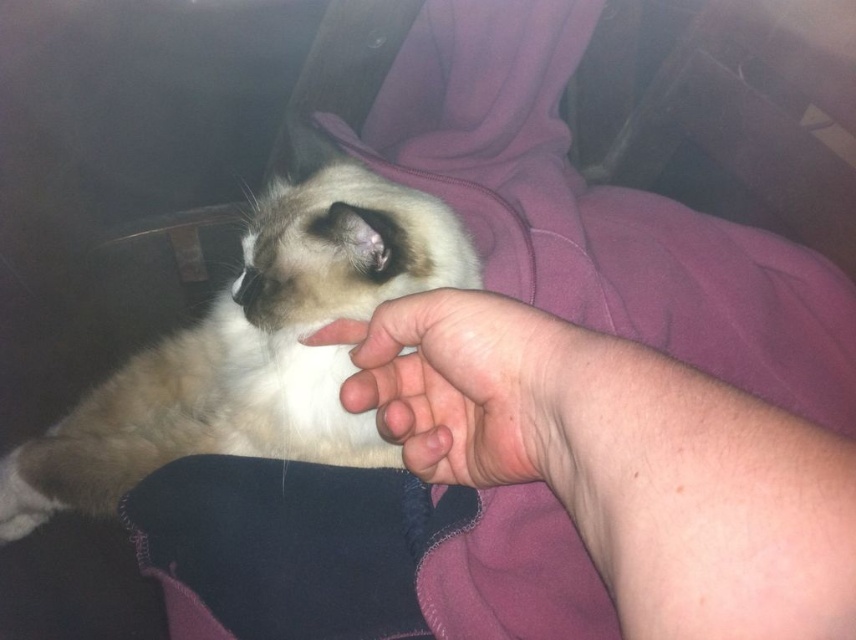
Question: Where is skinny flesh at center located in relation to pink flesh-toned hand at center in the image?

Choices:
 (A) below
 (B) above

Answer: (A)

Question: Considering the real-world distances, which object is farthest from the soft cream fur cat at center?

Choices:
 (A) pink flesh-toned hand at center
 (B) skinny flesh at center

Answer: (B)

Question: Estimate the real-world distances between objects in this image. Which object is farther from the skinny flesh at center?

Choices:
 (A) pink flesh-toned hand at center
 (B) soft cream fur cat at center

Answer: (B)

Question: Is soft cream fur cat at center bigger than pink flesh-toned hand at center?

Choices:
 (A) no
 (B) yes

Answer: (B)

Question: Can you confirm if soft cream fur cat at center is wider than pink flesh-toned hand at center?

Choices:
 (A) no
 (B) yes

Answer: (B)

Question: Which point is closer to the camera?

Choices:
 (A) pink flesh-toned hand at center
 (B) soft cream fur cat at center

Answer: (A)